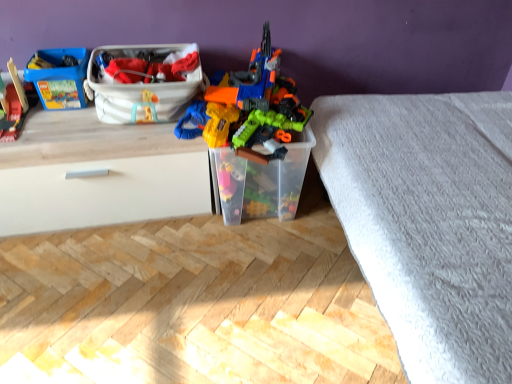
Where is `free location in front of matte plastic lego box at upper left, which appears as the third storage box when viewed from the right`? The height and width of the screenshot is (384, 512). free location in front of matte plastic lego box at upper left, which appears as the third storage box when viewed from the right is located at coordinates point(61,121).